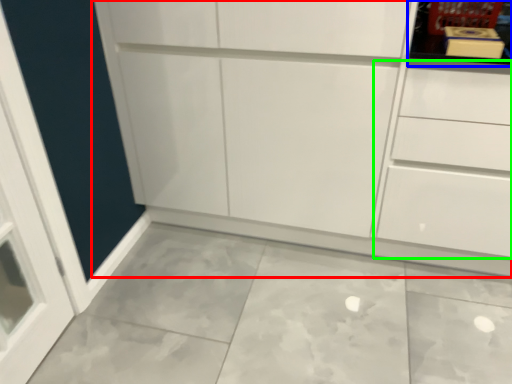
Question: Estimate the real-world distances between objects in this image. Which object is closer to cupboard (highlighted by a red box), shelf (highlighted by a blue box) or drawer (highlighted by a green box)?

Choices:
 (A) shelf
 (B) drawer

Answer: (B)